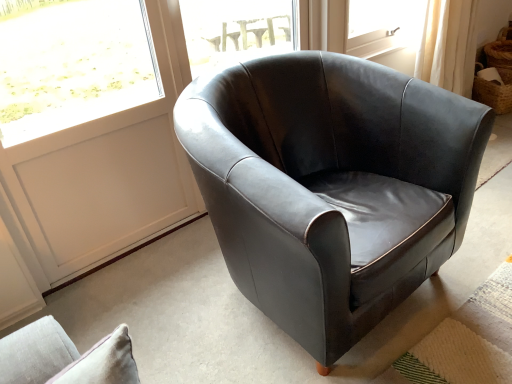
Question: Should I look upward or downward to see white panel at upper left?

Choices:
 (A) up
 (B) down

Answer: (A)

Question: Does woven brown basket at upper right appear on the left side of matte black armchair at center?

Choices:
 (A) yes
 (B) no

Answer: (B)

Question: From a real-world perspective, is woven brown basket at upper right over matte black armchair at center?

Choices:
 (A) yes
 (B) no

Answer: (B)

Question: Is woven brown basket at upper right thinner than matte black armchair at center?

Choices:
 (A) no
 (B) yes

Answer: (B)

Question: From the image's perspective, is woven brown basket at upper right on top of matte black armchair at center?

Choices:
 (A) no
 (B) yes

Answer: (B)

Question: From a real-world perspective, is woven brown basket at upper right below matte black armchair at center?

Choices:
 (A) yes
 (B) no

Answer: (A)

Question: Is woven brown basket at upper right not inside matte black armchair at center?

Choices:
 (A) no
 (B) yes

Answer: (B)

Question: Is transparent glass window at center located outside white panel at upper left?

Choices:
 (A) yes
 (B) no

Answer: (A)

Question: Is the depth of transparent glass window at center greater than that of white panel at upper left?

Choices:
 (A) no
 (B) yes

Answer: (B)

Question: Is transparent glass window at center thinner than white panel at upper left?

Choices:
 (A) yes
 (B) no

Answer: (B)

Question: Is transparent glass window at center in front of white panel at upper left?

Choices:
 (A) no
 (B) yes

Answer: (A)

Question: Does transparent glass window at center have a lesser height compared to white panel at upper left?

Choices:
 (A) no
 (B) yes

Answer: (B)

Question: Is there a large distance between transparent glass window at center and white panel at upper left?

Choices:
 (A) yes
 (B) no

Answer: (B)

Question: From the image's perspective, is white panel at upper left below matte black armchair at center?

Choices:
 (A) no
 (B) yes

Answer: (A)